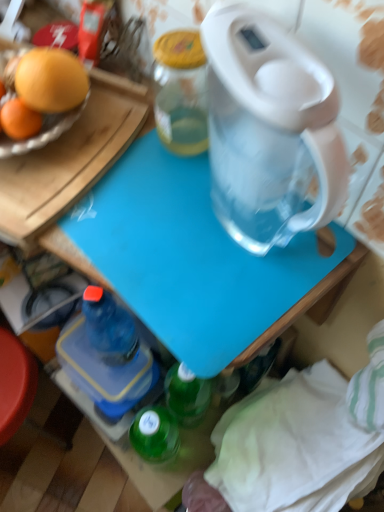
At what (x,y) coordinates should I click in order to perform the action: click on free space underneath blue plastic cutting board at center (from a real-world perspective). Please return your answer as a coordinate pair (x, y). This screenshot has width=384, height=512. Looking at the image, I should click on (236, 247).